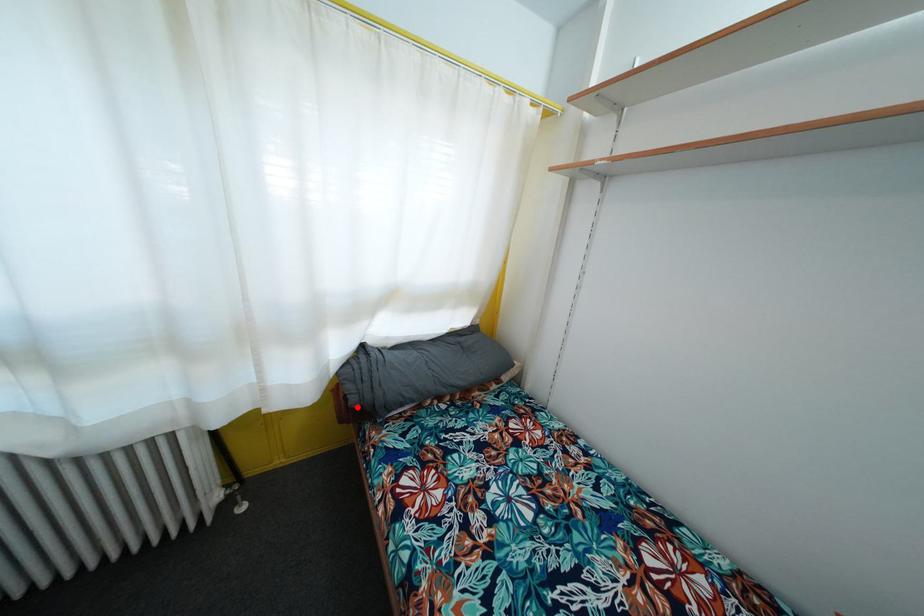
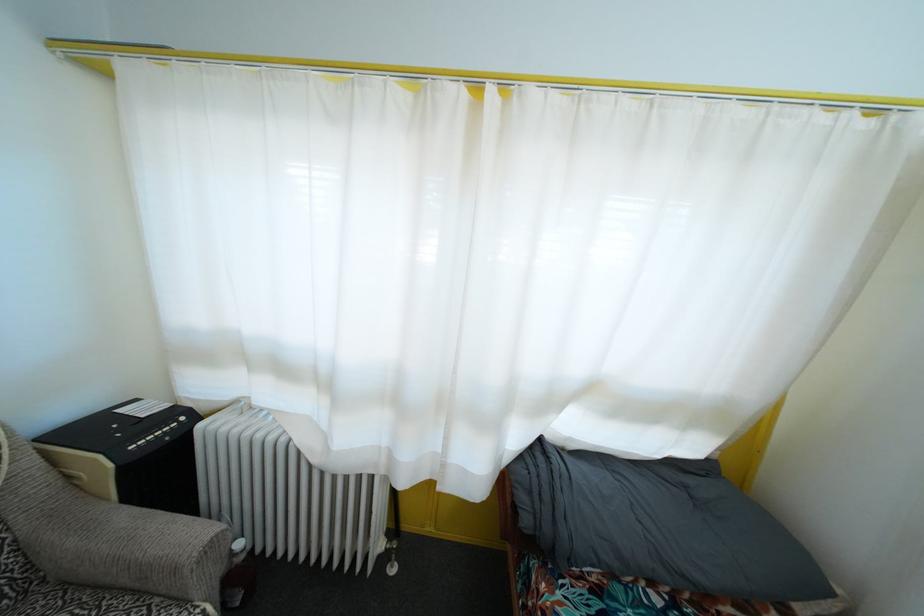
The point at the highlighted location is marked in the first image. Where is the corresponding point in the second image?

(529, 528)